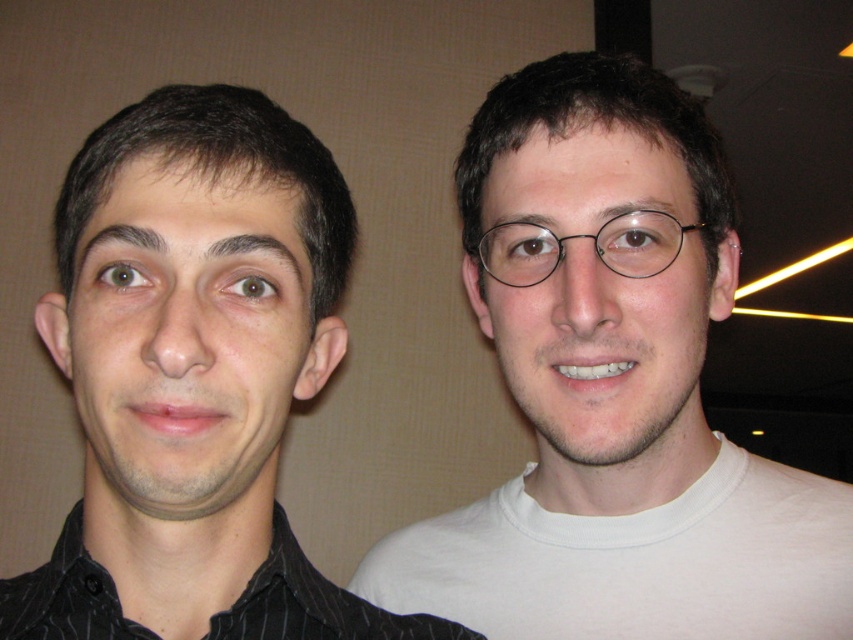
Does matte black face at left have a greater width compared to clear skin glasses at right?

Incorrect, matte black face at left's width does not surpass clear skin glasses at right's.

Does matte black face at left appear on the left side of clear skin glasses at right?

Correct, you'll find matte black face at left to the left of clear skin glasses at right.

Is point (177, 257) positioned before point (581, 307)?

Yes.

Where is `matte black face at left`? This screenshot has width=853, height=640. matte black face at left is located at coordinates (187, 337).

Can you confirm if matte black face at left is positioned below white cotton t-shirt at right?

Incorrect, matte black face at left is not positioned below white cotton t-shirt at right.

The image size is (853, 640). I want to click on matte black face at left, so click(x=187, y=337).

Locate an element on the screen. matte black face at left is located at coordinates (187, 337).

Is white matte shirt at right bigger than white cotton t-shirt at right?

Yes, white matte shirt at right is bigger than white cotton t-shirt at right.

Can you confirm if white matte shirt at right is positioned below white cotton t-shirt at right?

Incorrect, white matte shirt at right is not positioned below white cotton t-shirt at right.

Is point (460, 556) behind point (630, 592)?

Yes, point (460, 556) is behind point (630, 592).

Locate an element on the screen. white matte shirt at right is located at coordinates (613, 388).